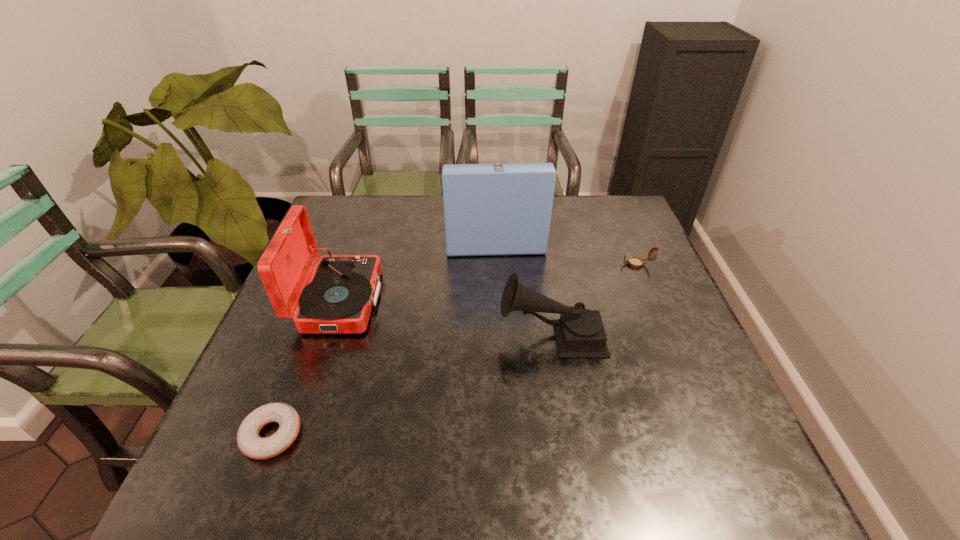
Image resolution: width=960 pixels, height=540 pixels. I want to click on phonograph_record at the left edge, so click(x=342, y=289).

Where is `doughnut at the left edge`? The image size is (960, 540). doughnut at the left edge is located at coordinates (249, 442).

Where is `object situated at the right edge`? This screenshot has height=540, width=960. object situated at the right edge is located at coordinates (635, 262).

Find the location of `object present at the near left corner`. object present at the near left corner is located at coordinates (249, 442).

This screenshot has width=960, height=540. In order to click on free spot at the far edge of the desktop in this screenshot , I will do `click(437, 207)`.

Identify the location of vacant space at the near edge of the desktop. coord(561,505).

In the image, there is a desktop. Where is `free space at the left edge`? free space at the left edge is located at coordinates (296, 457).

The height and width of the screenshot is (540, 960). Find the location of `vacant space at the right edge`. vacant space at the right edge is located at coordinates (615, 239).

The width and height of the screenshot is (960, 540). Find the location of `free space at the far left corner of the desktop`. free space at the far left corner of the desktop is located at coordinates (363, 222).

Identify the location of blank space at the far right corner. This screenshot has width=960, height=540. (590, 217).